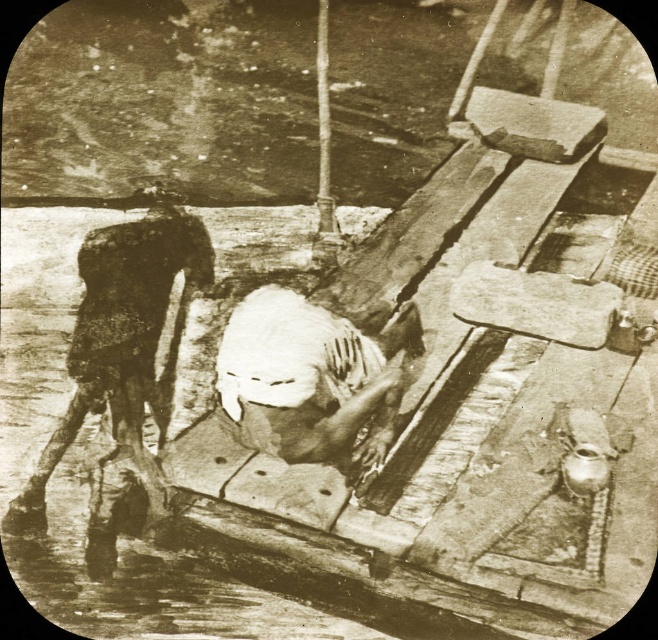
Who is positioned more to the right, rusty metal man at left or white clothed figure at center?

Positioned to the right is white clothed figure at center.

Is rusty metal man at left thinner than white clothed figure at center?

Indeed, rusty metal man at left has a lesser width compared to white clothed figure at center.

Image resolution: width=658 pixels, height=640 pixels. I want to click on rusty metal man at left, so click(118, 342).

You are a GUI agent. You are given a task and a screenshot of the screen. Output one action in this format:
    pyautogui.click(x=<x>, y=<y>)
    Task: Click on the rusty metal man at left
    Image resolution: width=658 pixels, height=640 pixels.
    Given the screenshot: What is the action you would take?
    pyautogui.click(x=118, y=342)